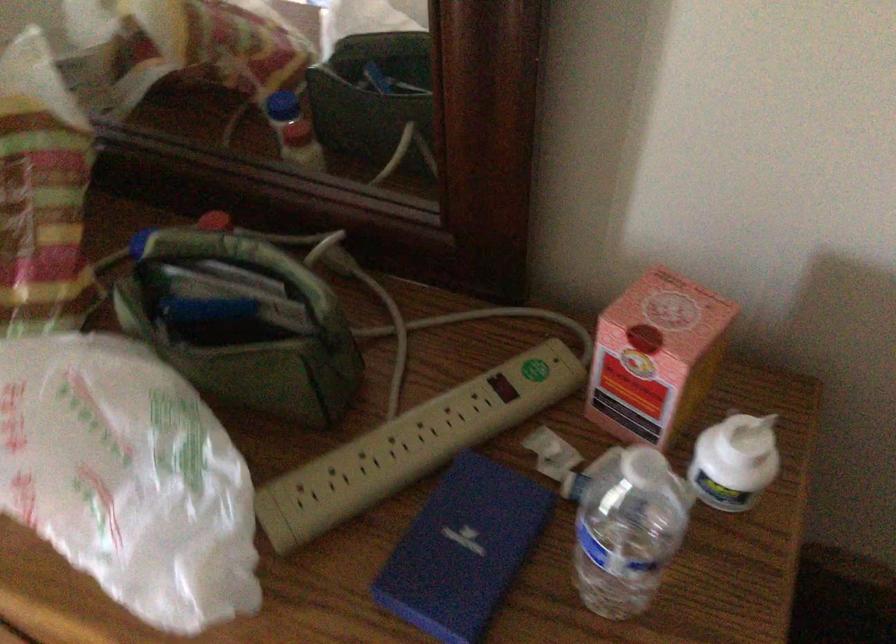
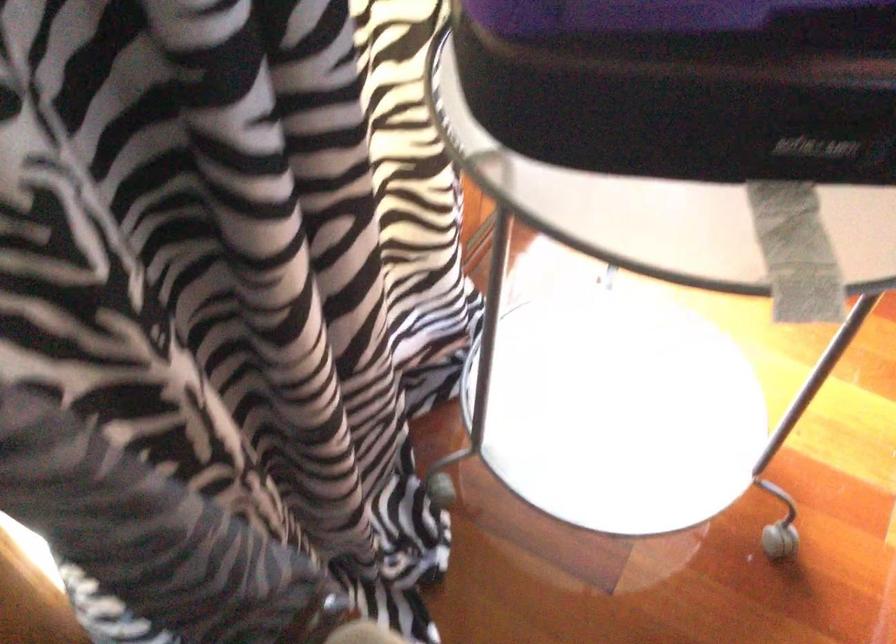
Question: Which direction would the cameraman need to move to produce the second image? Reply with the corresponding letter.

Choices:
 (A) Left
 (B) Right
 (C) Forward
 (D) Backward

Answer: (A)